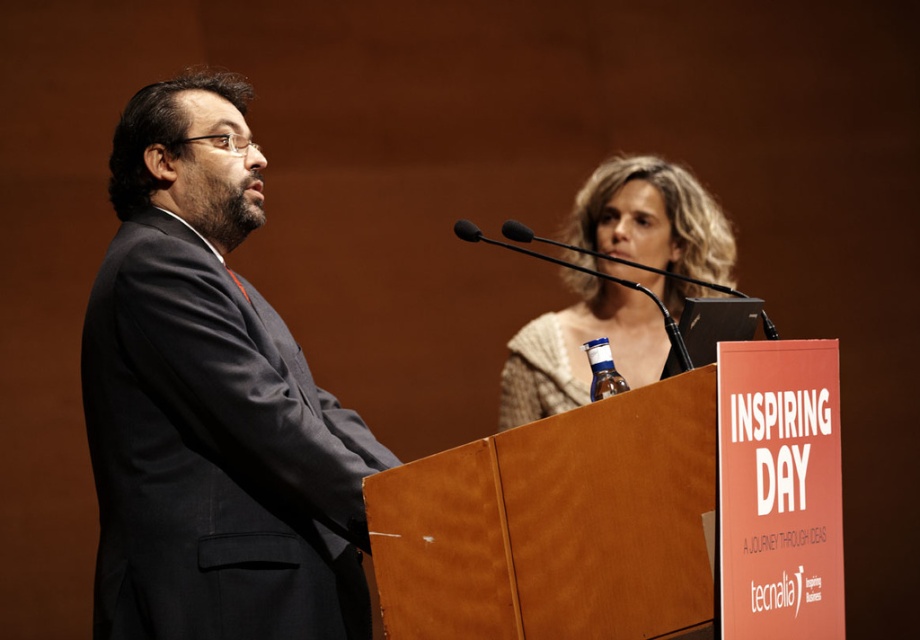
Is the position of knitted beige sweater at upper center more distant than that of blue plastic bottle at center?

Yes, knitted beige sweater at upper center is behind blue plastic bottle at center.

Does knitted beige sweater at upper center appear on the right side of blue plastic bottle at center?

Yes, knitted beige sweater at upper center is to the right of blue plastic bottle at center.

Who is more distant from viewer, (x=673, y=205) or (x=590, y=358)?

Point (x=673, y=205)

Locate an element on the screen. knitted beige sweater at upper center is located at coordinates (579, 349).

Can you confirm if knitted beige sweater at upper center is positioned to the left of black matte microphone at upper center?

Correct, you'll find knitted beige sweater at upper center to the left of black matte microphone at upper center.

Locate an element on the screen. Image resolution: width=920 pixels, height=640 pixels. knitted beige sweater at upper center is located at coordinates (579, 349).

Identify the location of knitted beige sweater at upper center. This screenshot has width=920, height=640. (579, 349).

This screenshot has width=920, height=640. What are the coordinates of `knitted beige sweater at upper center` in the screenshot? It's located at coord(579,349).

Does dark gray suit at left have a lesser width compared to blue plastic bottle at center?

No, dark gray suit at left is not thinner than blue plastic bottle at center.

Is dark gray suit at left smaller than blue plastic bottle at center?

Incorrect, dark gray suit at left is not smaller in size than blue plastic bottle at center.

Who is more distant from viewer, (x=133, y=173) or (x=606, y=392)?

Positioned behind is point (x=133, y=173).

This screenshot has height=640, width=920. Find the location of `dark gray suit at left`. dark gray suit at left is located at coordinates 210,403.